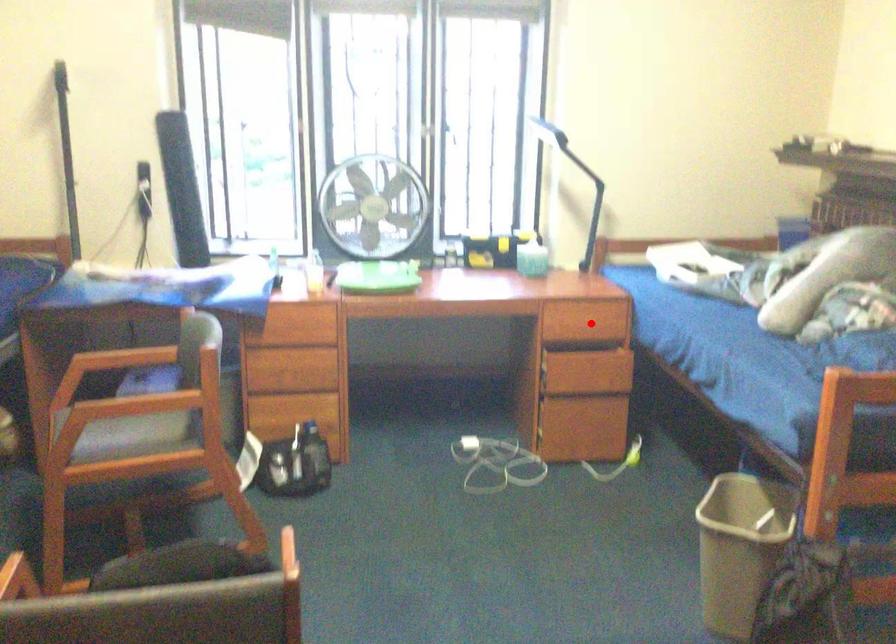
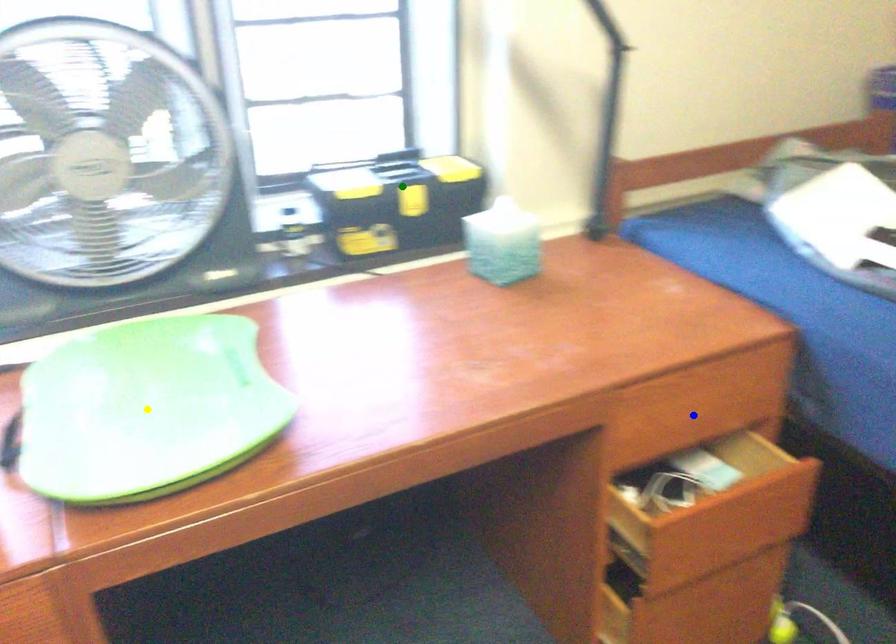
Question: I am providing you with two images of the same scene from different viewpoints. A red point is marked on the first image. You are given multiple points on the second image. Which mark in image 2 goes with the point in image 1?

Choices:
 (A) blue point
 (B) green point
 (C) yellow point

Answer: (A)